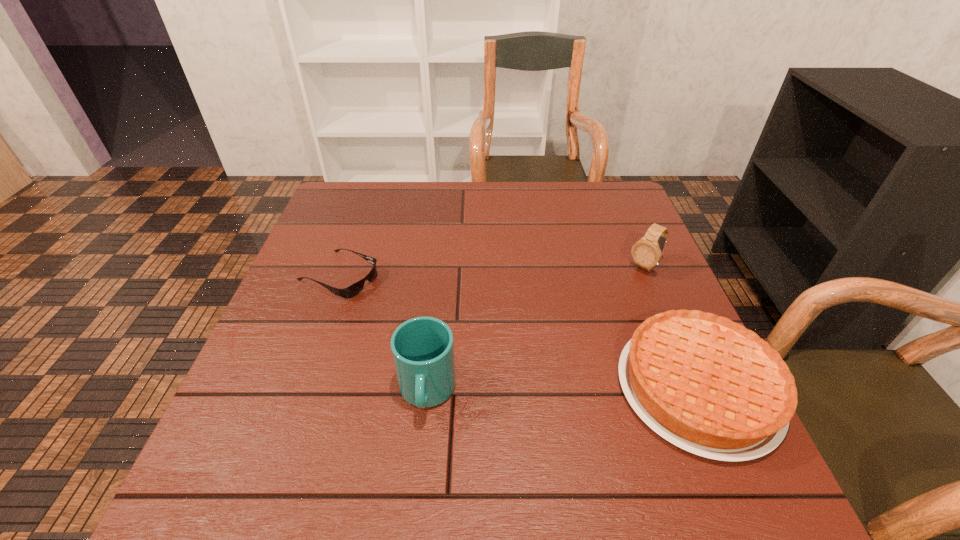
Locate an element on the screen. The height and width of the screenshot is (540, 960). vacant space positioned 0.280m on the front-facing side of the leftmost object is located at coordinates (470, 333).

Where is `free space located on the front-facing side of the leftmost object`? This screenshot has height=540, width=960. free space located on the front-facing side of the leftmost object is located at coordinates (483, 338).

At what (x,y) coordinates should I click in order to perform the action: click on cup situated at the near edge. Please return your answer as a coordinate pair (x, y). The height and width of the screenshot is (540, 960). Looking at the image, I should click on (422, 348).

I want to click on pie at the near edge, so click(x=706, y=384).

Where is `object that is positioned at the left edge`? object that is positioned at the left edge is located at coordinates pos(348,292).

Where is `pie at the right edge`? The height and width of the screenshot is (540, 960). pie at the right edge is located at coordinates (706, 384).

Image resolution: width=960 pixels, height=540 pixels. I want to click on watch located at the right edge, so click(646, 253).

Identify the location of object located at the near right corner. (706, 384).

Identify the location of free spot at the far edge of the desktop. This screenshot has width=960, height=540. (491, 218).

In the image, there is a desktop. Identify the location of vacant area at the near edge. The height and width of the screenshot is (540, 960). (472, 410).